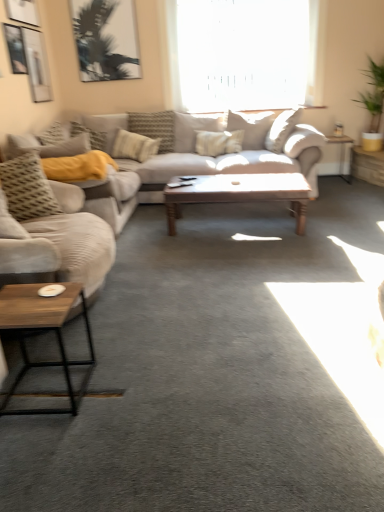
Question: Would you say textured gray pillow at left, the fifth pillow from the back, is inside or outside wooden/metallic coffee table at lower left, the 2th coffee table viewed from the back?

Choices:
 (A) outside
 (B) inside

Answer: (A)

Question: In terms of width, does textured gray pillow at left, the 2th pillow positioned from the left, look wider or thinner when compared to wooden/metallic coffee table at lower left, the 2th coffee table viewed from the back?

Choices:
 (A) wide
 (B) thin

Answer: (B)

Question: Which is nearer to the wooden/metallic coffee table at lower left, which appears as the 2th coffee table when viewed from the top?

Choices:
 (A) green leafy plant in yellow pot at upper right
 (B) beige fabric couch at left, the 1th studio couch positioned from the front
 (C) beige fabric couch at center, the 2th studio couch viewed from the front
 (D) textured gray pillow at left, the 2th pillow positioned from the left
 (E) wooden side table at right, which is the 1th table from right to left

Answer: (B)

Question: Based on their relative distances, which object is nearer to the textured beige pillow at center, which appears as the first pillow when viewed from the back?

Choices:
 (A) beige fabric couch at left, which ranks as the second studio couch in back-to-front order
 (B) metallic silver picture frame at upper left
 (C) textured gray pillow at left, the 4th pillow when ordered from right to left
 (D) wooden polished coffee table at center, the 1th coffee table from the right
 (E) green leafy plant in yellow pot at upper right

Answer: (B)